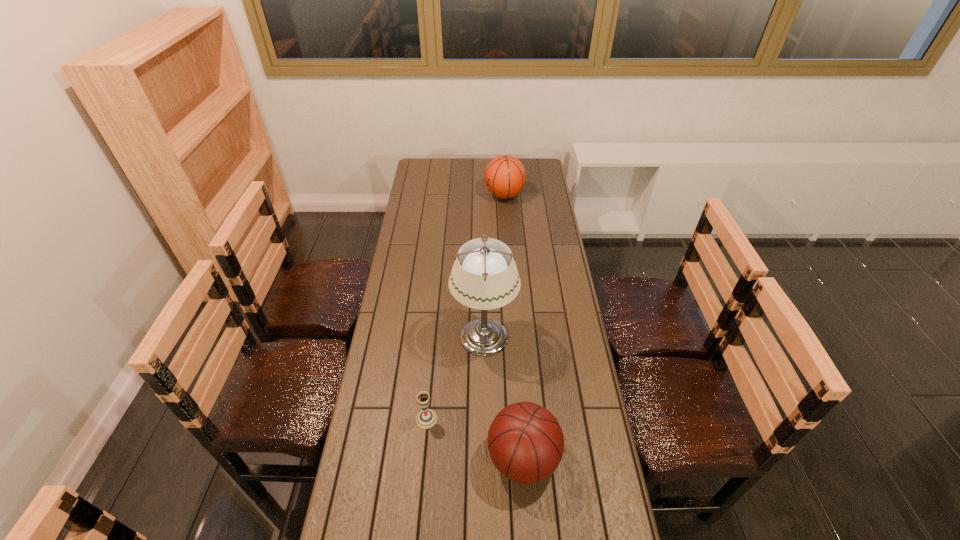
This screenshot has width=960, height=540. Find the location of `free space located on the back of the nearer basketball`. free space located on the back of the nearer basketball is located at coordinates (516, 356).

The image size is (960, 540). Identify the location of vacant space located on the front of the shortest object. [x=418, y=512].

Where is `vacant space at the left edge`? vacant space at the left edge is located at coordinates (417, 273).

Image resolution: width=960 pixels, height=540 pixels. What are the coordinates of `free region at the right edge` in the screenshot? It's located at (583, 367).

In the image, there is a desktop. Where is `vacant region at the far left corner`? Image resolution: width=960 pixels, height=540 pixels. vacant region at the far left corner is located at coordinates (419, 175).

I want to click on vacant space at the far right corner of the desktop, so click(529, 168).

This screenshot has width=960, height=540. Find the location of `free space between the shortest object and the farther basketball`. free space between the shortest object and the farther basketball is located at coordinates (466, 307).

At what (x,y) coordinates should I click in order to perform the action: click on unoccupied area between the chalice and the lampshade. Please return your answer as a coordinate pair (x, y). This screenshot has height=540, width=960. Looking at the image, I should click on (455, 377).

Where is `free space between the nearer basketball and the leftmost object`? The width and height of the screenshot is (960, 540). free space between the nearer basketball and the leftmost object is located at coordinates (475, 438).

The width and height of the screenshot is (960, 540). Find the location of `vacant area between the nearer basketball and the farthest object`. vacant area between the nearer basketball and the farthest object is located at coordinates (514, 327).